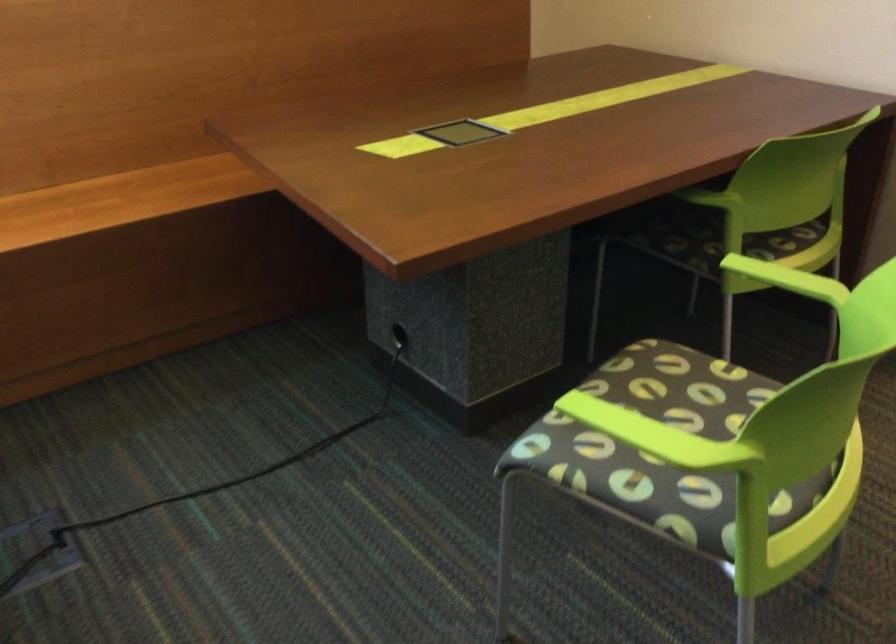
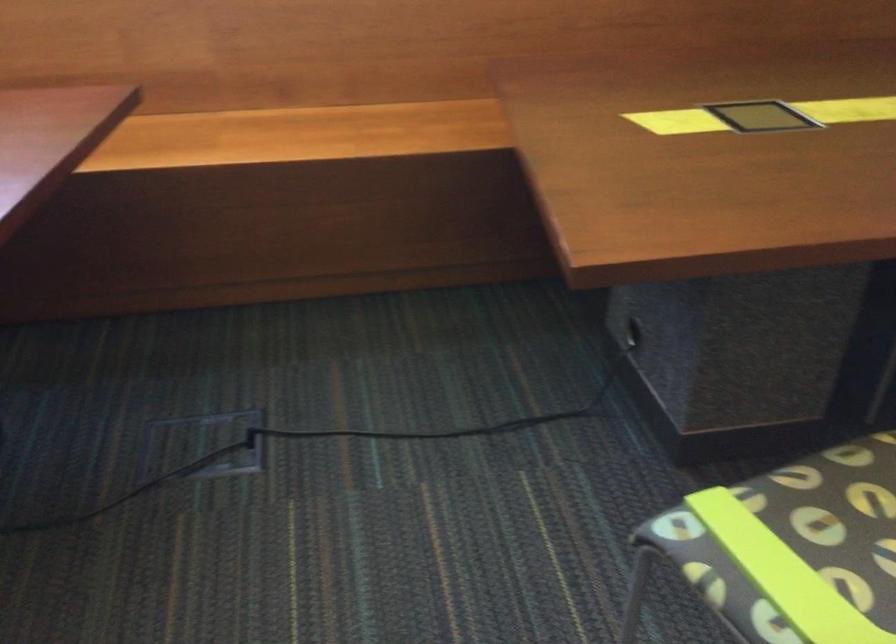
Question: The first image is from the beginning of the video and the second image is from the end. How did the camera likely rotate when shooting the video?

Choices:
 (A) Left
 (B) Right
 (C) Up
 (D) Down

Answer: (A)